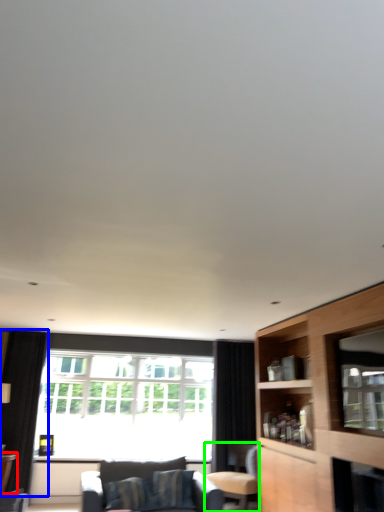
Question: Which object is the farthest from table (highlighted by a red box)? Choose among these: curtain (highlighted by a blue box) or chair (highlighted by a green box).

Choices:
 (A) curtain
 (B) chair

Answer: (B)